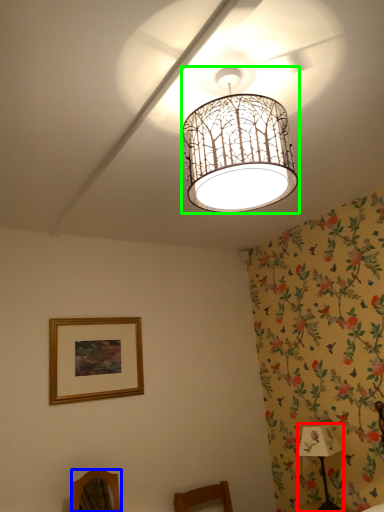
Question: Estimate the real-world distances between objects in this image. Which object is closer to table lamp (highlighted by a red box), furniture (highlighted by a blue box) or lamp (highlighted by a green box)?

Choices:
 (A) furniture
 (B) lamp

Answer: (A)